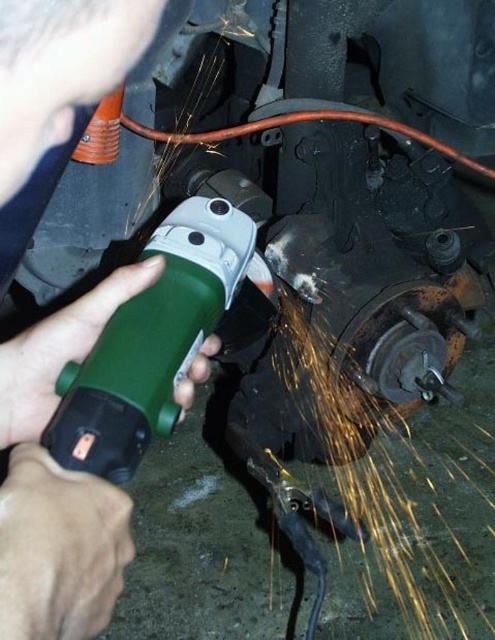
You are an engineer inspecting the mechanical component being worked on by the angle grinder. You notice two points marked on the surface of the component. The first point is at coordinates point (114, 556) and the second point is at point (99, 433). Which of these two points is closer to you?

Point (114, 556) is closer to the viewer than point (99, 433).

You are a mechanic working on a vehicle engine. You have a green plastic grinder at center and a green plastic angle grinder at center. Which tool is closer to your hands while holding them?

The green plastic grinder at center and green plastic angle grinder at center are 2.72 inches apart, so the one closer to your hands would depend on their exact positions, but since both are at the center, they might be part of the same tool. However, based on the description, the green plastic grinder at center is likely the one being held, so it is closer to your hands.